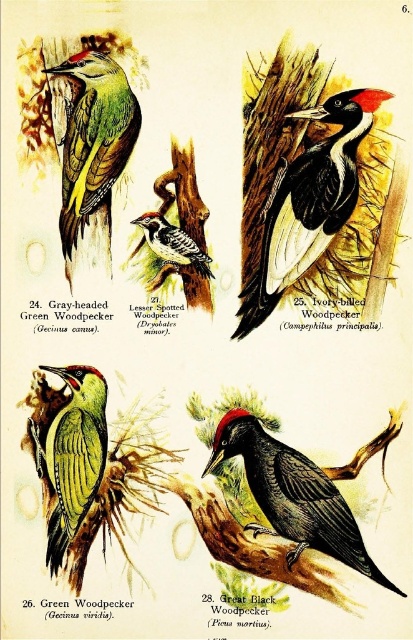
Based on the scene description, where exactly is the green matte woodpecker at upper left located in terms of coordinates?

The green matte woodpecker at upper left is located at coordinates point (92, 145).

You are a birdwatcher trying to photograph two woodpeckers in the image. The shiny black woodpecker at lower right and the speckled brown woodpecker at center are both in your viewfinder. If you want to capture both in a single frame without moving your camera, which woodpecker should you focus on to ensure both are in focus?

You should focus on the speckled brown woodpecker at center because the shiny black woodpecker at lower right is only 13.43 inches away from it, so keeping the speckled brown woodpecker in focus will likely keep both within the depth of field.